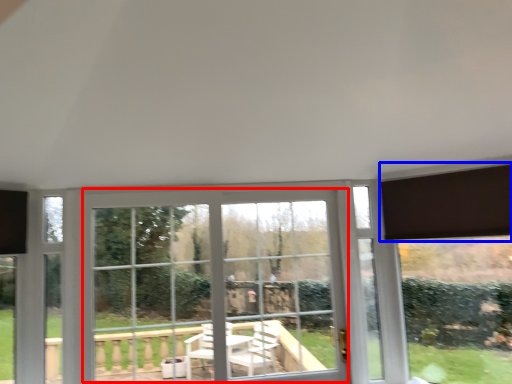
Question: Which object is further to the camera taking this photo, bay window (highlighted by a red box) or curtain (highlighted by a blue box)?

Choices:
 (A) bay window
 (B) curtain

Answer: (A)